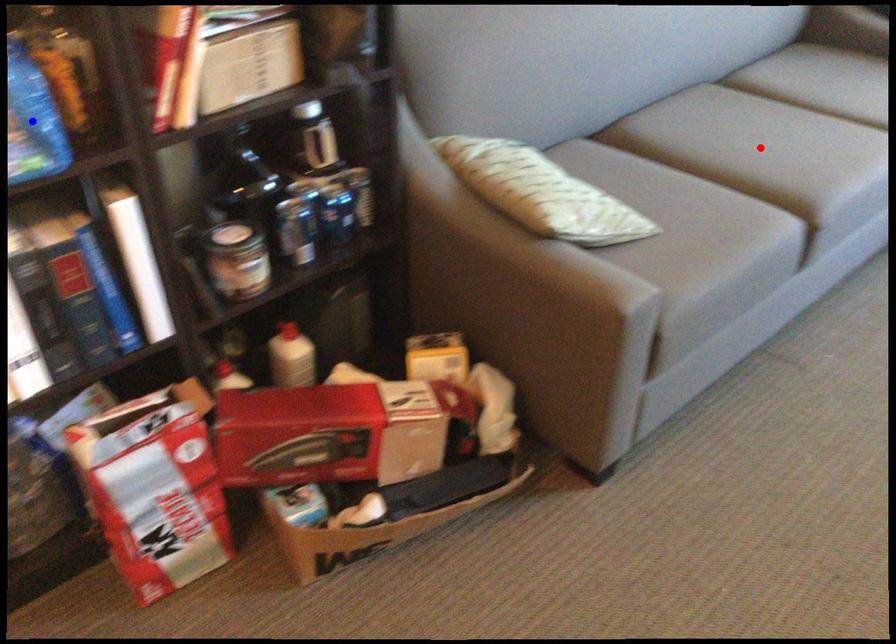
Question: In the image, two points are highlighted. Which point is nearer to the camera? Reply with the corresponding letter.

Choices:
 (A) blue point
 (B) red point

Answer: (A)